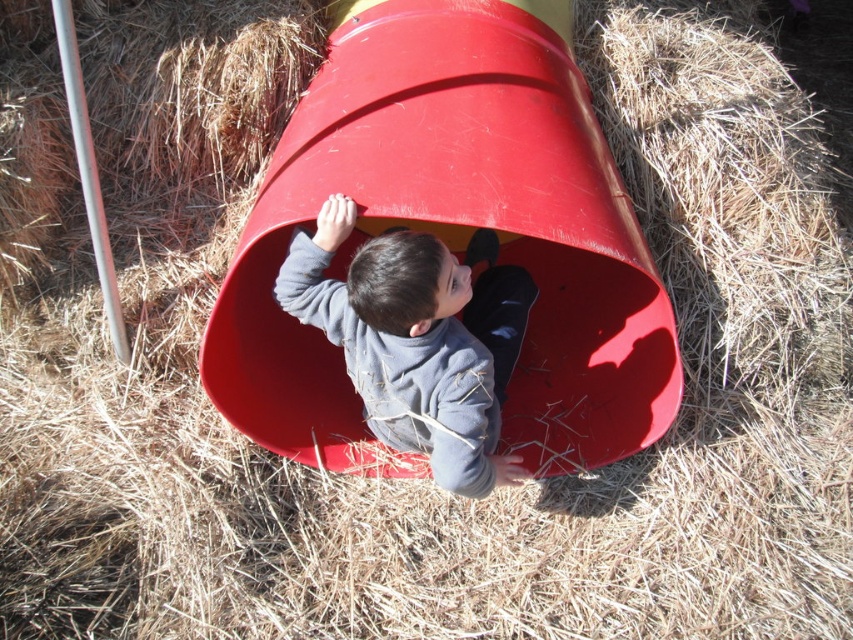
You are a parent trying to locate your child who is wearing a matte gray sweater at center. You see the smooth plastic slide at center in the playground. Which object is closer to you?

The smooth plastic slide at center is closer to the viewer than the matte gray sweater at center, so the slide is closer to you.

You are standing in the playground and see two points marked on the tunnel. Which point is closer to you, point (558, 166) or point (384, 280)?

Point (558, 166) is further to the viewer than point (384, 280), so point (384, 280) is closer to you.